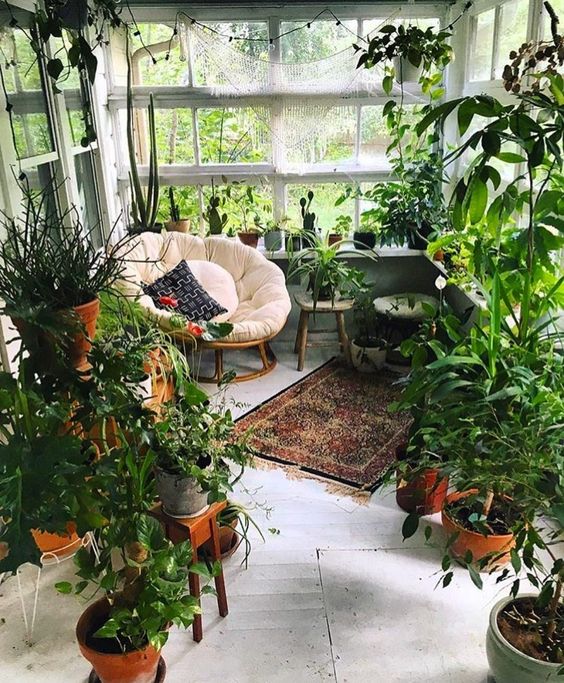
Locate an element on the screen. something to sit on is located at coordinates 229,285, 409,311, 342,306.